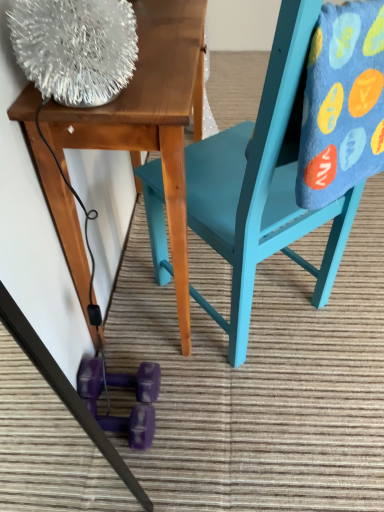
Find the location of a particular element. free space above wooden table at upper left (from a real-world perspective) is located at coordinates (160, 32).